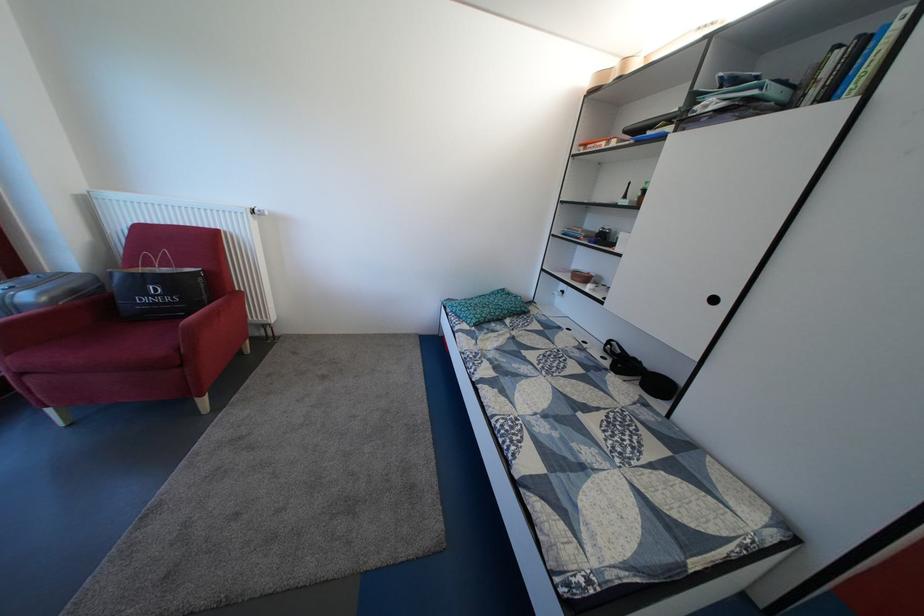
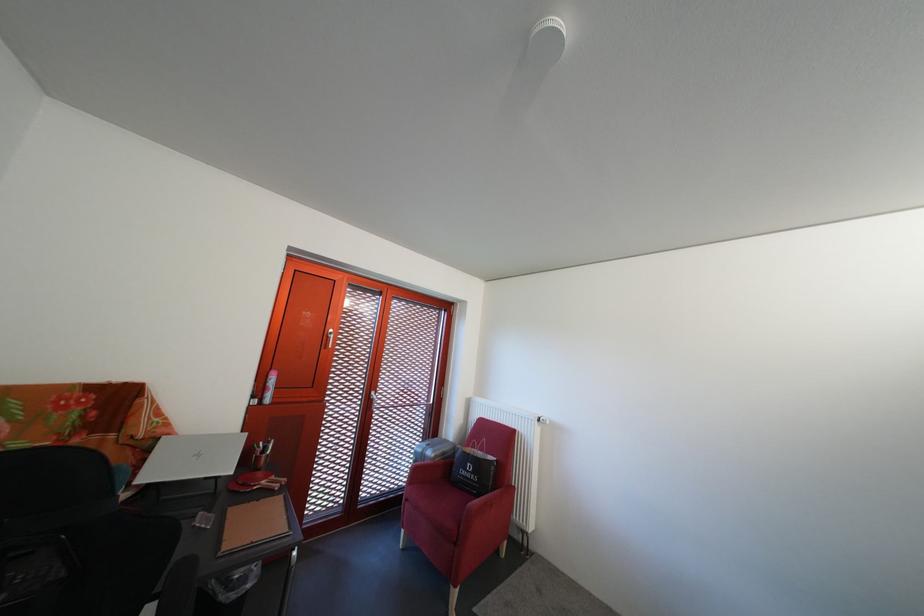
Find the pixel in the second image that matches pixel 39 304 in the first image.

(441, 459)